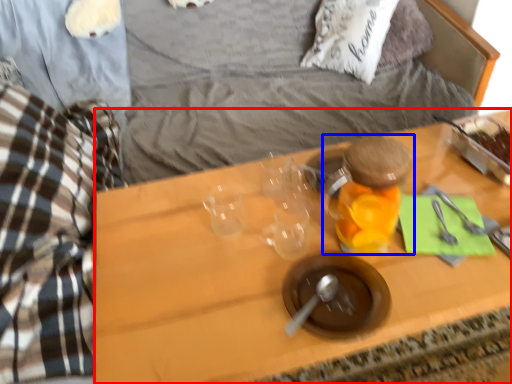
Question: Which object appears closest to the camera in this image, desk (highlighted by a red box) or bottle (highlighted by a blue box)?

Choices:
 (A) desk
 (B) bottle

Answer: (A)